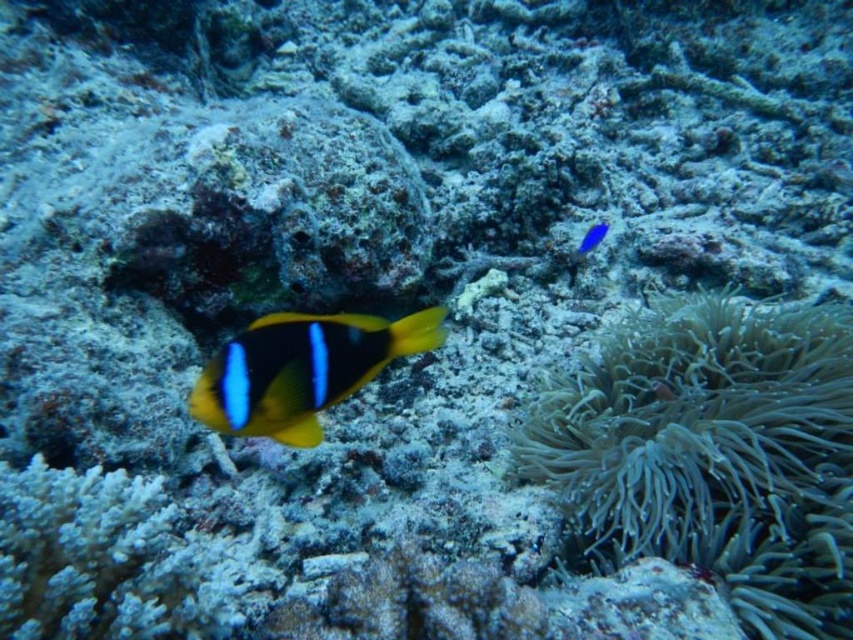
Between soft gray coral at lower right and glossy blue fish at upper right, which one has more height?

With more height is soft gray coral at lower right.

Where is `soft gray coral at lower right`? soft gray coral at lower right is located at coordinates (712, 452).

Does soft gray coral at lower right appear on the right side of yellow matte clownfish at center?

Yes, soft gray coral at lower right is to the right of yellow matte clownfish at center.

Can you confirm if soft gray coral at lower right is wider than yellow matte clownfish at center?

Indeed, soft gray coral at lower right has a greater width compared to yellow matte clownfish at center.

Locate an element on the screen. soft gray coral at lower right is located at coordinates (712, 452).

Is yellow matte clownfish at center to the left of glossy blue fish at upper right from the viewer's perspective?

Indeed, yellow matte clownfish at center is positioned on the left side of glossy blue fish at upper right.

Between point (256, 358) and point (590, 236), which one is positioned behind?

Point (590, 236)

The width and height of the screenshot is (853, 640). I want to click on yellow matte clownfish at center, so click(300, 369).